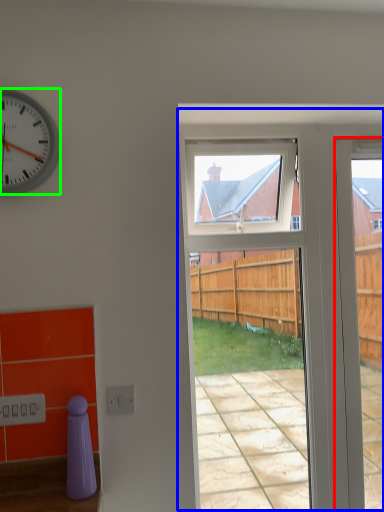
Question: Based on their relative distances, which object is nearer to door (highlighted by a red box)? Choose from screen door (highlighted by a blue box) and clock (highlighted by a green box).

Choices:
 (A) screen door
 (B) clock

Answer: (A)